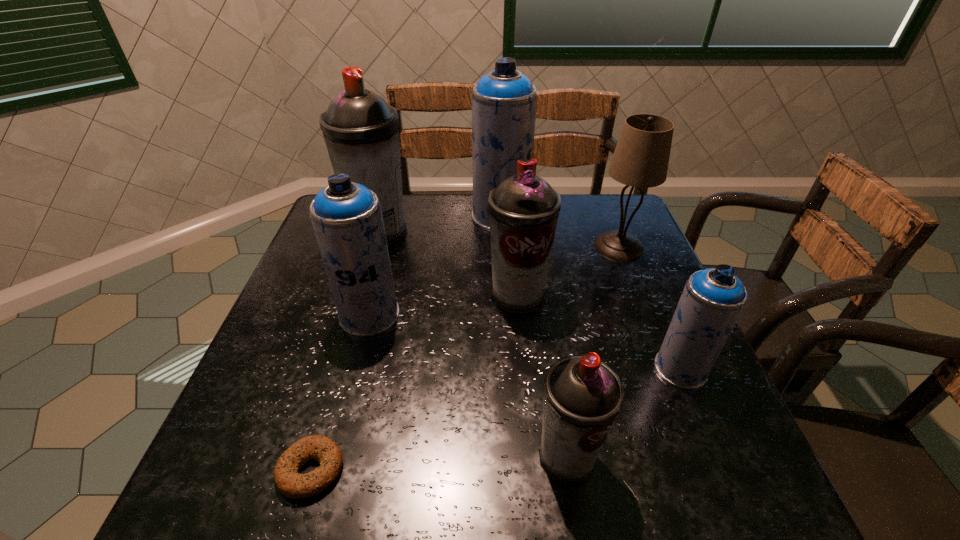
Locate an element on the screen. This screenshot has height=540, width=960. the smallest gray aerosol can is located at coordinates (582, 396).

Identify the location of the nearest aerosol can. (582, 396).

Identify the location of brown bagel. Image resolution: width=960 pixels, height=540 pixels. (289, 482).

I want to click on the shortest object, so click(289, 482).

Find the location of a particular element. free space located 0.230m on the front of the leftmost gray aerosol can is located at coordinates (356, 310).

At what (x,y) coordinates should I click in order to perform the action: click on vacant space situated 0.160m on the right of the farthest blue aerosol can. Please return your answer as a coordinate pair (x, y). This screenshot has height=540, width=960. Looking at the image, I should click on (581, 216).

Where is `vacant space located on the front-facing side of the lampshade`? vacant space located on the front-facing side of the lampshade is located at coordinates tap(655, 338).

The width and height of the screenshot is (960, 540). I want to click on vacant position located on the back of the second nearest blue aerosol can, so click(379, 276).

Where is `vacant space located 0.070m on the front of the second farthest gray aerosol can`? This screenshot has height=540, width=960. vacant space located 0.070m on the front of the second farthest gray aerosol can is located at coordinates [x=521, y=340].

You are a GUI agent. You are given a task and a screenshot of the screen. Output one action in this format:
    pyautogui.click(x=<x>, y=<y>)
    Task: Click on the vacant area located 0.110m on the front of the rightmost aerosol can
    The height and width of the screenshot is (540, 960).
    Given the screenshot: What is the action you would take?
    pyautogui.click(x=711, y=442)